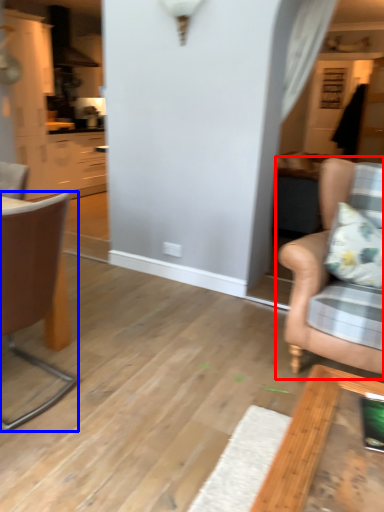
Question: Among these objects, which one is nearest to the camera, chair (highlighted by a red box) or chair (highlighted by a blue box)?

Choices:
 (A) chair
 (B) chair

Answer: (B)